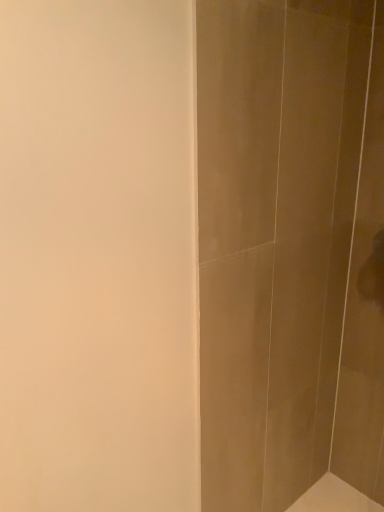
The height and width of the screenshot is (512, 384). Describe the element at coordinates (290, 248) in the screenshot. I see `matte gray tile at right` at that location.

Measure the distance between matte gray tile at right and camera.

34.95 inches.

Where is `matte gray tile at right`? The image size is (384, 512). matte gray tile at right is located at coordinates (290, 248).

The width and height of the screenshot is (384, 512). I want to click on matte gray tile at right, so click(x=290, y=248).